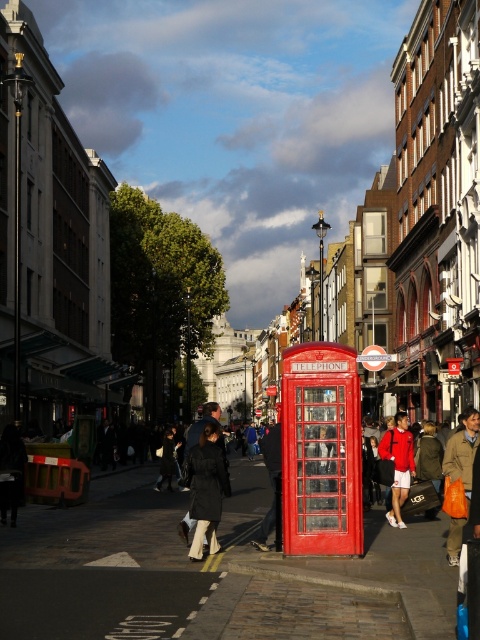
You are standing on the street looking at the iconic red telephone box in the center. There are two points marked on the ground, one at coordinates point [214,496] and the other at point [397,481]. Which point is closer to you as you face the telephone box?

Point [214,496] is closer to you because it is in front of point [397,481] when facing the telephone box.